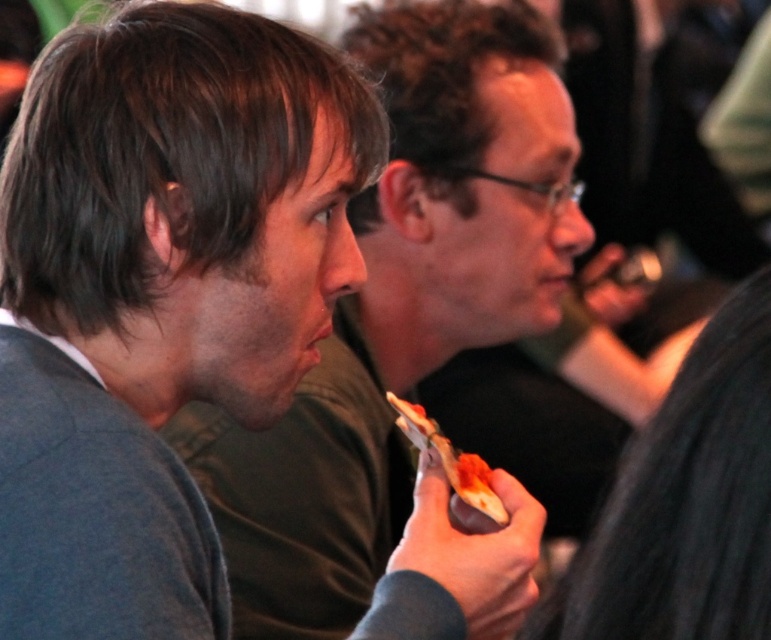
Question: Which of these objects is positioned farthest from the matte gray sweater at left?

Choices:
 (A) dark gray sweater at left
 (B) dark gray textured shirt at right
 (C) tomato sauce pizza slice at center

Answer: (B)

Question: Is dark gray sweater at left positioned in front of tomato sauce pizza slice at center?

Choices:
 (A) yes
 (B) no

Answer: (A)

Question: Which point is closer to the camera?

Choices:
 (A) dark gray textured shirt at right
 (B) dark gray sweater at left

Answer: (B)

Question: Which point appears closest to the camera in this image?

Choices:
 (A) (403, 513)
 (B) (217, 337)

Answer: (B)

Question: Is matte gray sweater at left above tomato sauce pizza slice at center?

Choices:
 (A) yes
 (B) no

Answer: (A)

Question: Can you confirm if matte gray sweater at left is positioned below dark gray textured shirt at right?

Choices:
 (A) yes
 (B) no

Answer: (B)